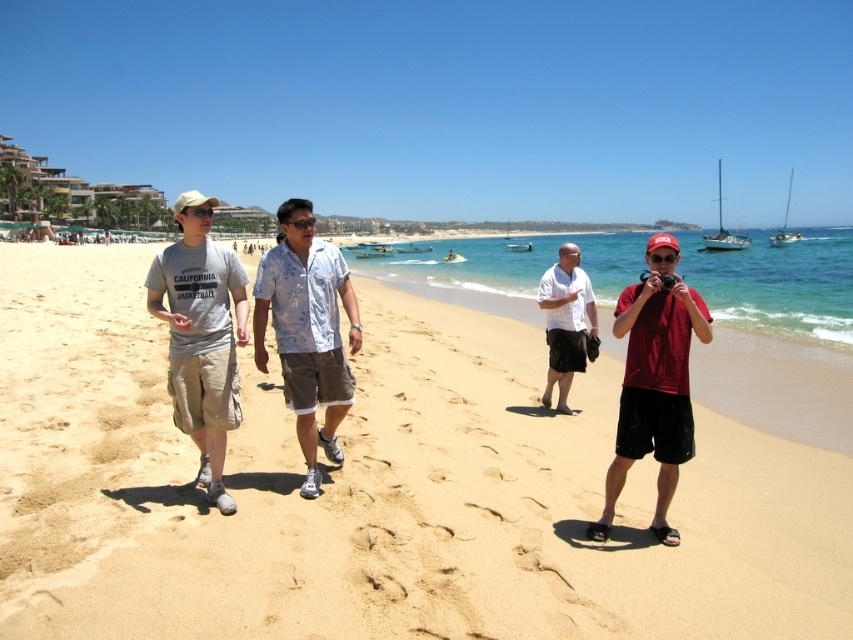
Is point (676, 298) less distant than point (548, 305)?

Yes, point (676, 298) is in front of point (548, 305).

In the scene shown: Who is positioned more to the left, matte red shirt at center or white cotton shirt at center?

white cotton shirt at center is more to the left.

Who is more distant from viewer, (666,538) or (544,385)?

The point (544,385) is behind.

Locate an element on the screen. The height and width of the screenshot is (640, 853). matte red shirt at center is located at coordinates (654, 381).

Which of these two, floral fabric shirt at center or matte red shirt at center, stands taller?

Standing taller between the two is matte red shirt at center.

What do you see at coordinates (306, 330) in the screenshot? I see `floral fabric shirt at center` at bounding box center [306, 330].

Who is more distant from viewer, (x=294, y=369) or (x=625, y=385)?

Positioned behind is point (x=294, y=369).

Find the location of a particular element. floral fabric shirt at center is located at coordinates (306, 330).

Is beige sand at center smaller than gray cotton t-shirt at left?

Actually, beige sand at center might be larger than gray cotton t-shirt at left.

What do you see at coordinates (376, 490) in the screenshot?
I see `beige sand at center` at bounding box center [376, 490].

Locate an element on the screen. This screenshot has height=640, width=853. beige sand at center is located at coordinates (376, 490).

Where is `beige sand at center`? This screenshot has width=853, height=640. beige sand at center is located at coordinates (376, 490).